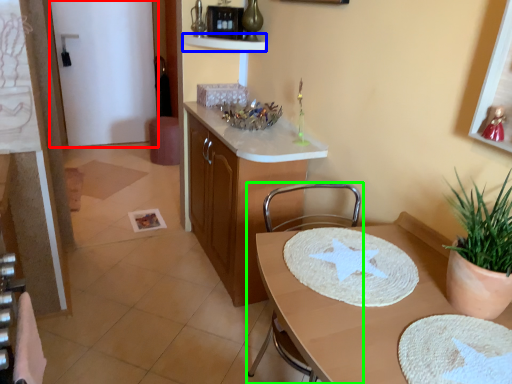
Question: Estimate the real-world distances between objects in this image. Which object is closer to glass door (highlighted by a red box), shelf (highlighted by a blue box) or chair (highlighted by a green box)?

Choices:
 (A) shelf
 (B) chair

Answer: (A)